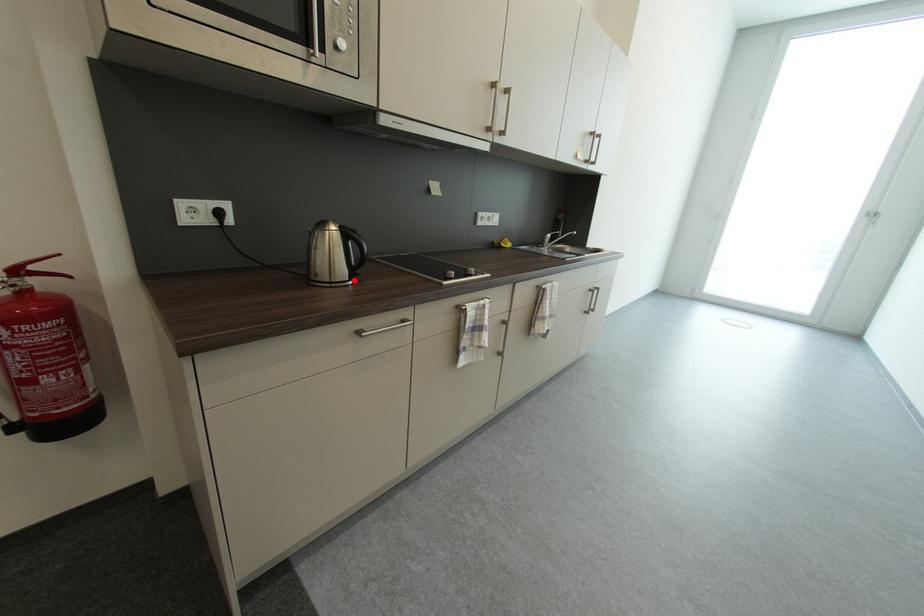
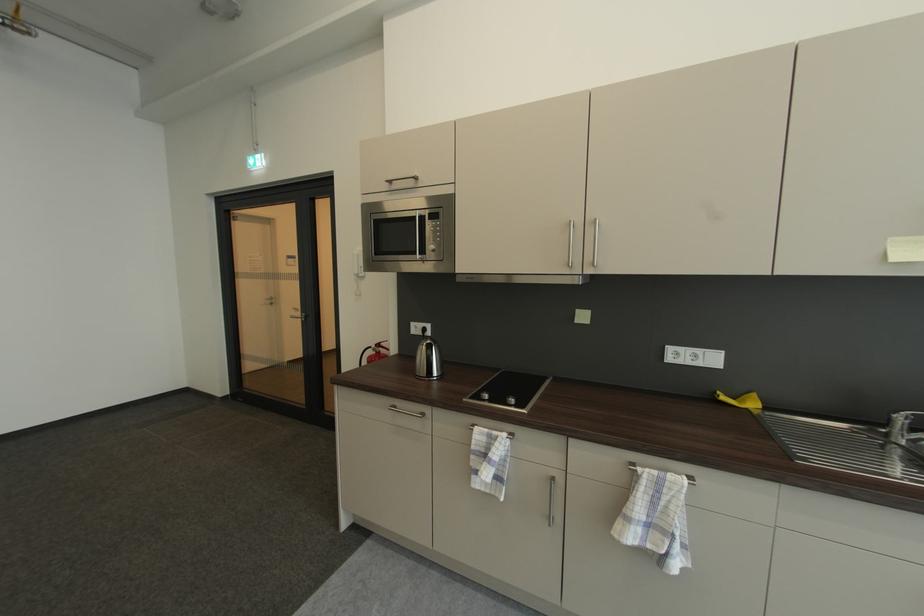
Locate, in the second image, the point that corresponds to the highlighted location in the first image.

(432, 378)